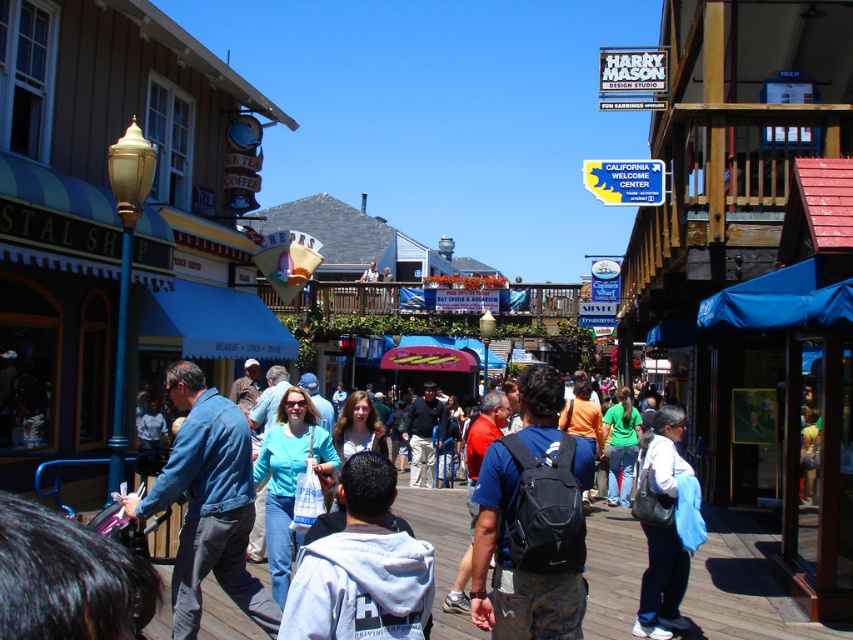
You are a customer looking for a souvenir to buy. You see a denim jacket at lower left and a white cotton shirt at center. Which item is located to the left of the other?

The denim jacket at lower left is positioned on the left side of white cotton shirt at center, so it is located to the left of the white cotton shirt at center.